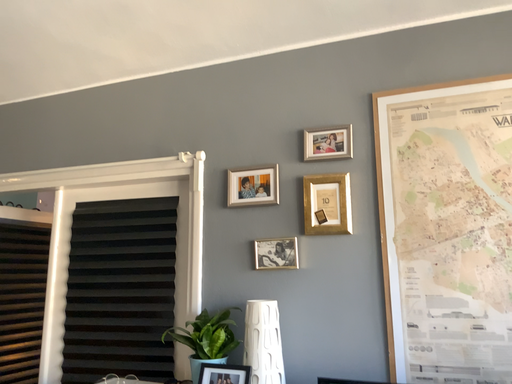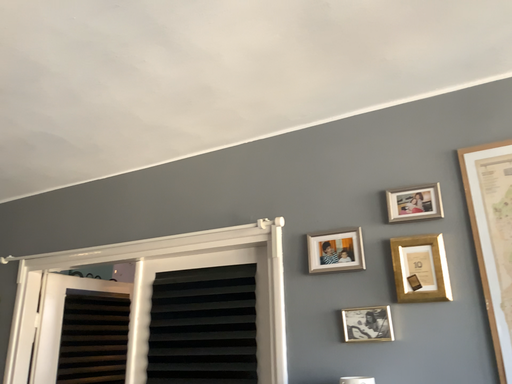
Question: Which way did the camera rotate in the video?

Choices:
 (A) rotated upward
 (B) rotated downward

Answer: (A)